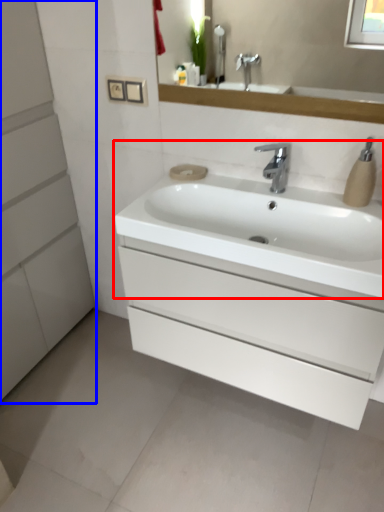
Question: Which of the following is the closest to the observer, sink (highlighted by a red box) or bathroom cabinet (highlighted by a blue box)?

Choices:
 (A) sink
 (B) bathroom cabinet

Answer: (B)